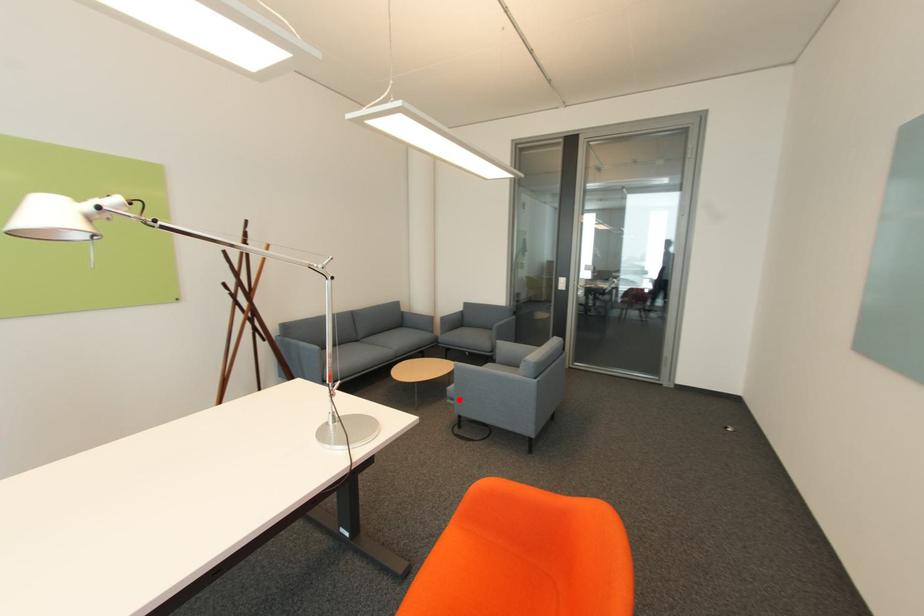
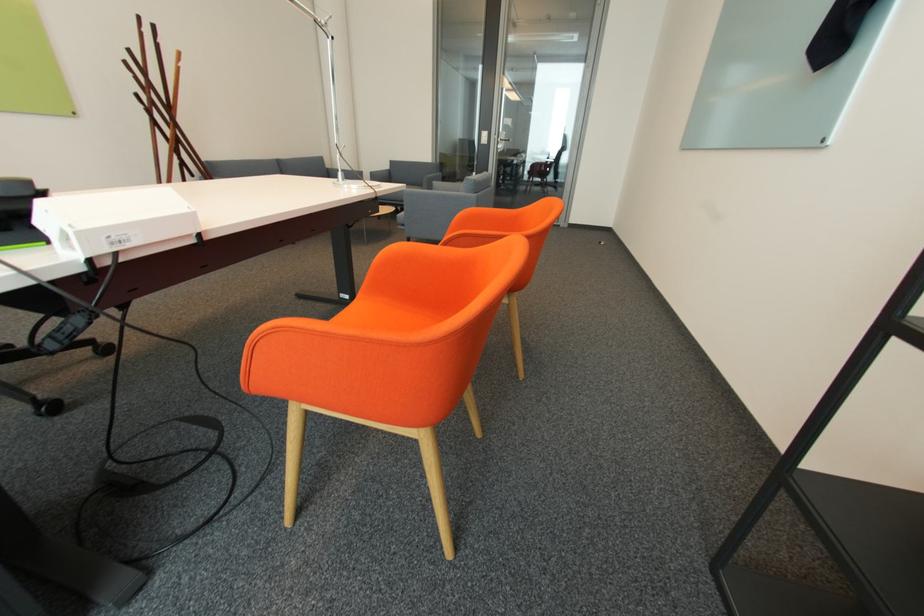
Question: I am providing you with two images of the same scene from different viewpoints. In image1, a red point is highlighted. Considering the same 3D point in image2, which of the following is correct?

Choices:
 (A) It is closer
 (B) It is farther

Answer: (A)